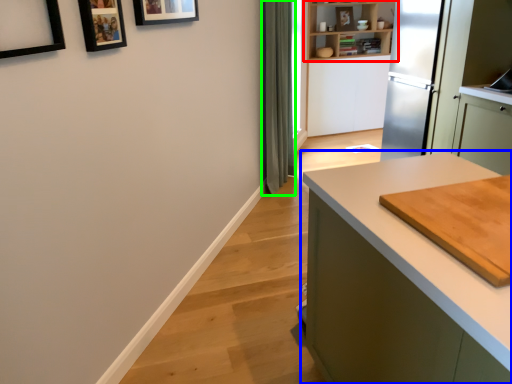
Question: Considering the real-world distances, which object is closest to shelf (highlighted by a red box)? countertop (highlighted by a blue box) or curtain (highlighted by a green box).

Choices:
 (A) countertop
 (B) curtain

Answer: (B)